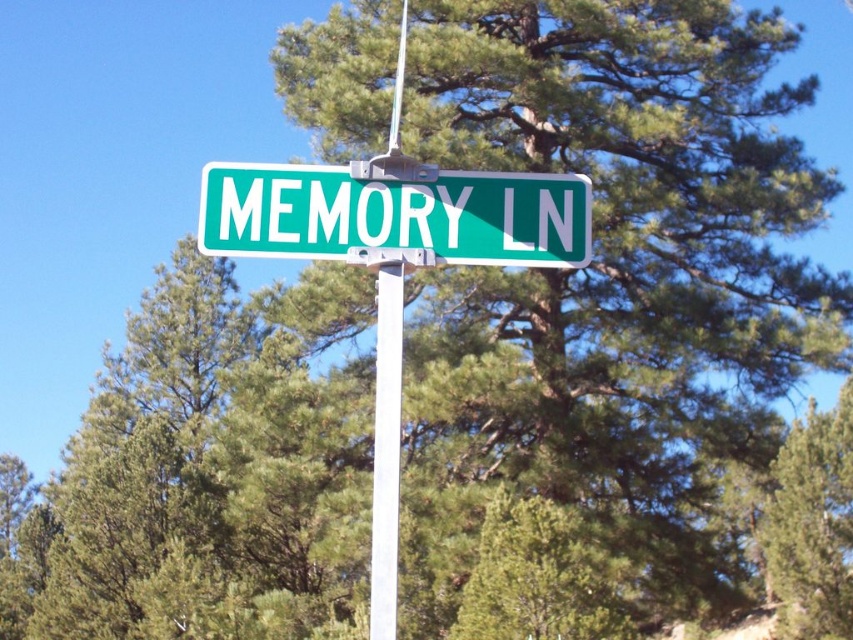
You are a painter who wants to paint the green metallic street sign at center and the white smooth pole at center. You have a ladder that can reach up to 2.5 meters. Can you safely paint both objects using this ladder?

The distance between the green metallic street sign at center and the white smooth pole at center is 2.49 meters. Since the ladder can reach up to 2.5 meters, you can safely paint both objects as the required distance is just under the ladder capacity.

What are the coordinates of the green metallic street sign at center?

The green metallic street sign at center is located at point (395, 216).

Consider the image. You are a painter who wants to paint the green metallic street sign at center and the white smooth pole at center. Which object should you focus on first if you want to paint the taller one first?

The white smooth pole at center is taller than the green metallic street sign at center, so you should paint the white smooth pole at center first.